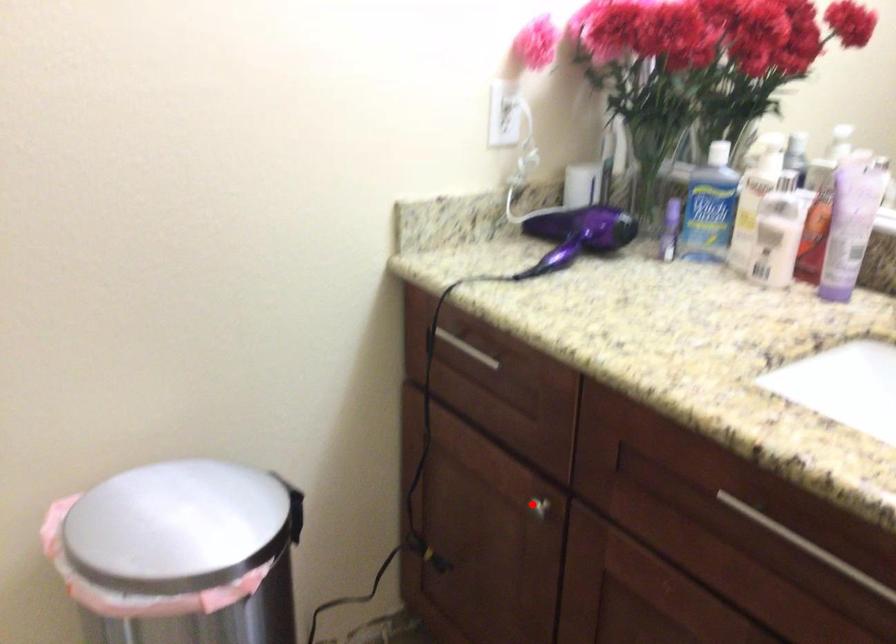
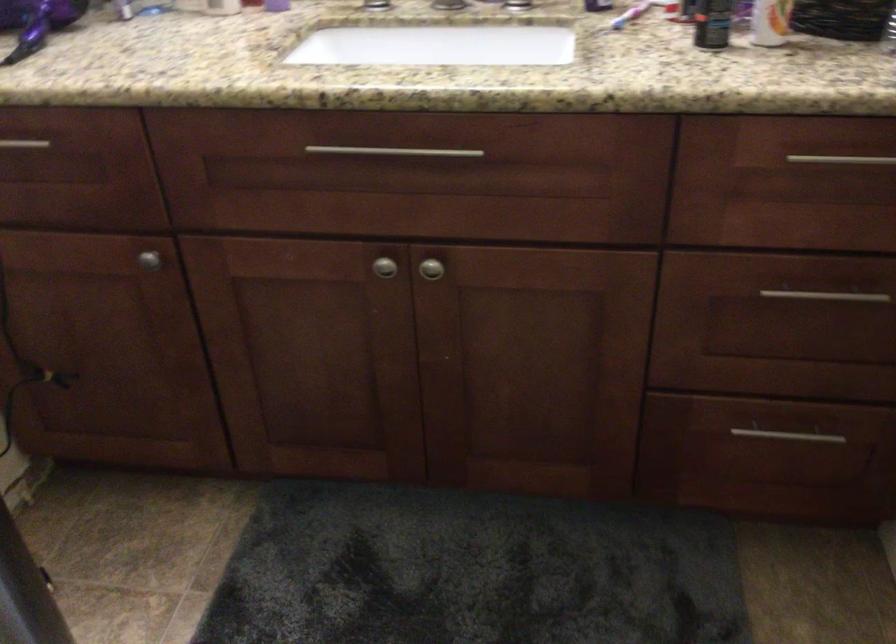
Locate, in the second image, the point that corresponds to the highlighted location in the first image.

(149, 259)